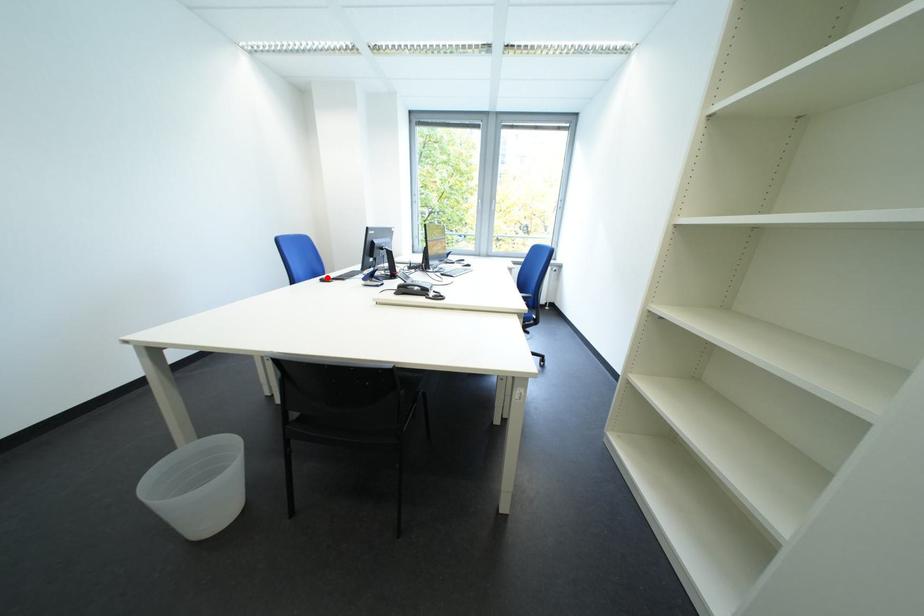
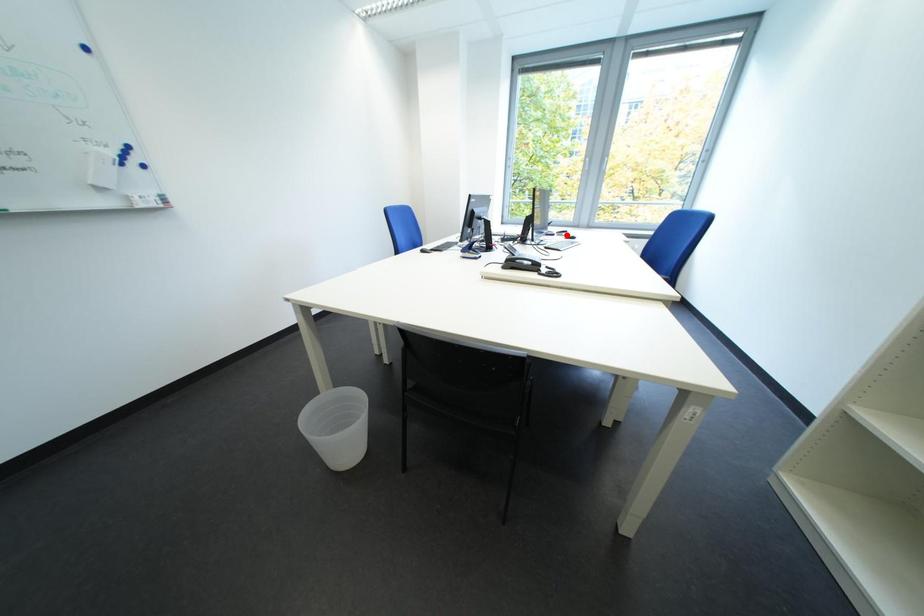
I am providing you with two images of the same scene from different viewpoints. A red point is marked on the first image and another point is marked on the second image. Do the highlighted points in image1 and image2 indicate the same real-world spot?

No